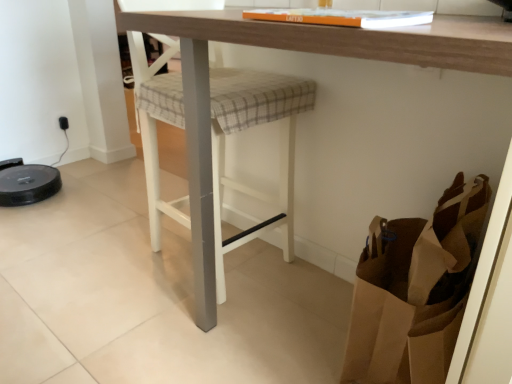
Where is `wooden table at center`? wooden table at center is located at coordinates (304, 51).

Where is `plaid fabric step stool at center`? plaid fabric step stool at center is located at coordinates (250, 126).

This screenshot has width=512, height=384. I want to click on table on the right side of plaid fabric step stool at center, so click(x=304, y=51).

Does point (240, 244) come closer to viewer compared to point (183, 80)?

No.

Between plaid fabric step stool at center and wooden table at center, which one has larger size?

With larger size is wooden table at center.

From a real-world perspective, is plaid fabric step stool at center above or below brown paper bag at lower right?

plaid fabric step stool at center is above brown paper bag at lower right.

Does plaid fabric step stool at center turn towards brown paper bag at lower right?

Yes, plaid fabric step stool at center is facing brown paper bag at lower right.

Does plaid fabric step stool at center have a lesser width compared to brown paper bag at lower right?

No, plaid fabric step stool at center is not thinner than brown paper bag at lower right.

Can you tell me how much wooden table at center and brown paper bag at lower right differ in facing direction?

There is a 0.457-degree angle between the facing directions of wooden table at center and brown paper bag at lower right.

The width and height of the screenshot is (512, 384). Find the location of `shopping bag behind the wooden table at center`. shopping bag behind the wooden table at center is located at coordinates (415, 289).

Which is more to the left, wooden table at center or brown paper bag at lower right?

wooden table at center is more to the left.

Which of these two, wooden table at center or brown paper bag at lower right, stands shorter?

brown paper bag at lower right is shorter.

Which is closer to the camera, [340,35] or [182,109]?

Point [340,35]

Image resolution: width=512 pixels, height=384 pixels. Find the location of `table below the plaid fabric step stool at center (from a real-world perspective)`. table below the plaid fabric step stool at center (from a real-world perspective) is located at coordinates (304, 51).

Which is in front, wooden table at center or plaid fabric step stool at center?

wooden table at center.

Considering the sizes of objects wooden table at center and plaid fabric step stool at center in the image provided, who is bigger, wooden table at center or plaid fabric step stool at center?

wooden table at center is bigger.

Does brown paper bag at lower right turn towards wooden table at center?

Yes, brown paper bag at lower right is facing wooden table at center.

At what (x,y) coordinates should I click in order to perform the action: click on shopping bag to the right of wooden table at center. Please return your answer as a coordinate pair (x, y). Image resolution: width=512 pixels, height=384 pixels. Looking at the image, I should click on (415, 289).

From a real-world perspective, between brown paper bag at lower right and wooden table at center, who is vertically lower?

From a 3D spatial view, brown paper bag at lower right is below.

Which of these two, brown paper bag at lower right or wooden table at center, is wider?

Wider between the two is wooden table at center.

Considering the positions of point (424, 320) and point (215, 128), is point (424, 320) closer or farther from the camera than point (215, 128)?

Clearly, point (424, 320) is closer to the camera than point (215, 128).

From a real-world perspective, which is physically above, brown paper bag at lower right or plaid fabric step stool at center?

plaid fabric step stool at center, from a real-world perspective.

Who is more distant, brown paper bag at lower right or plaid fabric step stool at center?

plaid fabric step stool at center is more distant.

Identify the location of table below the plaid fabric step stool at center (from a real-world perspective). The width and height of the screenshot is (512, 384). (304, 51).

In the image, there is a plaid fabric step stool at center. Where is `shopping bag below it (from the image's perspective)`? The image size is (512, 384). shopping bag below it (from the image's perspective) is located at coordinates (415, 289).

Based on their spatial positions, is plaid fabric step stool at center or wooden table at center closer to brown paper bag at lower right?

Among the two, wooden table at center is located nearer to brown paper bag at lower right.

Which object lies further to the anchor point wooden table at center, brown paper bag at lower right or plaid fabric step stool at center?

brown paper bag at lower right is further to wooden table at center.

Looking at the image, which one is located closer to plaid fabric step stool at center, wooden table at center or brown paper bag at lower right?

The object closer to plaid fabric step stool at center is wooden table at center.

Estimate the real-world distances between objects in this image. Which object is further from brown paper bag at lower right, wooden table at center or plaid fabric step stool at center?

plaid fabric step stool at center lies further to brown paper bag at lower right than the other object.

Which object lies nearer to the anchor point wooden table at center, plaid fabric step stool at center or brown paper bag at lower right?

plaid fabric step stool at center lies closer to wooden table at center than the other object.

Considering their positions, is brown paper bag at lower right positioned further to plaid fabric step stool at center than wooden table at center?

brown paper bag at lower right is positioned further to the anchor plaid fabric step stool at center.

Find the location of `shopping bag between wooden table at center and plaid fabric step stool at center along the z-axis`. shopping bag between wooden table at center and plaid fabric step stool at center along the z-axis is located at coordinates (415, 289).